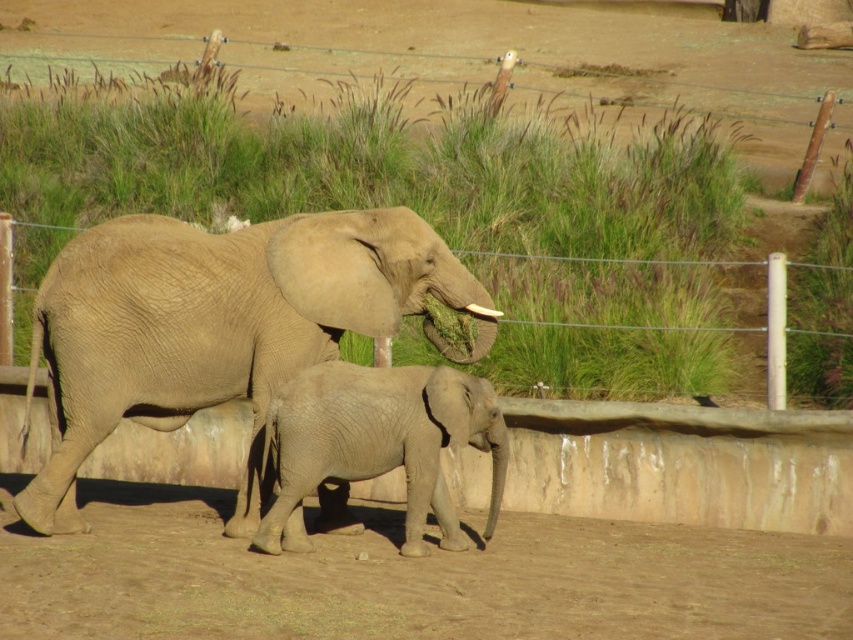
Is gray matte elephant at center positioned in front of wire mesh fence at center?

Yes, gray matte elephant at center is in front of wire mesh fence at center.

Which of these two, gray matte elephant at center or wire mesh fence at center, stands shorter?

With less height is wire mesh fence at center.

Is point (329, 403) behind point (677, 330)?

No, (329, 403) is closer to viewer.

Identify the location of gray matte elephant at center. (378, 444).

Can you confirm if gray textured elephant at center is positioned to the left of gray matte elephant at center?

Indeed, gray textured elephant at center is positioned on the left side of gray matte elephant at center.

Can you confirm if gray textured elephant at center is smaller than gray matte elephant at center?

Incorrect, gray textured elephant at center is not smaller in size than gray matte elephant at center.

Between point (178, 417) and point (277, 541), which one is positioned behind?

The point (178, 417) is behind.

You are a GUI agent. You are given a task and a screenshot of the screen. Output one action in this format:
    pyautogui.click(x=<x>, y=<y>)
    Task: Click on the gray textured elephant at center
    This screenshot has width=853, height=640.
    Given the screenshot: What is the action you would take?
    coord(218,326)

Does gray textured elephant at center come behind wire mesh fence at center?

No, it is in front of wire mesh fence at center.

Does gray textured elephant at center appear under wire mesh fence at center?

Correct, gray textured elephant at center is located below wire mesh fence at center.

Locate an element on the screen. gray textured elephant at center is located at coordinates (218, 326).

Locate an element on the screen. The image size is (853, 640). gray textured elephant at center is located at coordinates (218, 326).